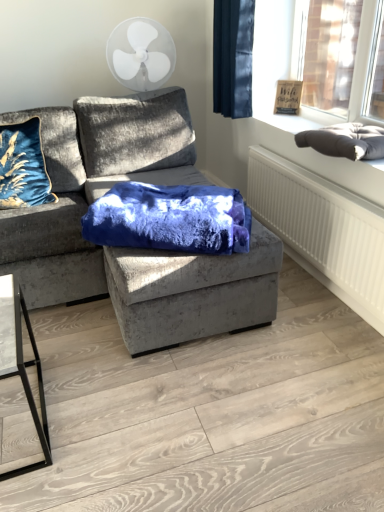
Question: From their relative heights in the image, would you say velvet gray couch at center is taller or shorter than dark blue velvet curtain at upper right?

Choices:
 (A) short
 (B) tall

Answer: (B)

Question: Based on their positions, is velvet gray couch at center located to the left or right of dark blue velvet curtain at upper right?

Choices:
 (A) right
 (B) left

Answer: (B)

Question: Estimate the real-world distances between objects in this image. Which object is farther from the dark gray cushion at upper right?

Choices:
 (A) velvet blue blanket at center
 (B) dark gray plush cushion at upper right
 (C) dark blue velvet curtain at upper right
 (D) white textured radiator at lower right
 (E) velvet gray couch at center

Answer: (E)

Question: Based on their relative distances, which object is farther from the white textured radiator at lower right?

Choices:
 (A) white plastic fan at upper center
 (B) velvet gray couch at center
 (C) velvet blue blanket at center
 (D) dark gray plush cushion at upper right
 (E) dark gray cushion at upper right

Answer: (A)